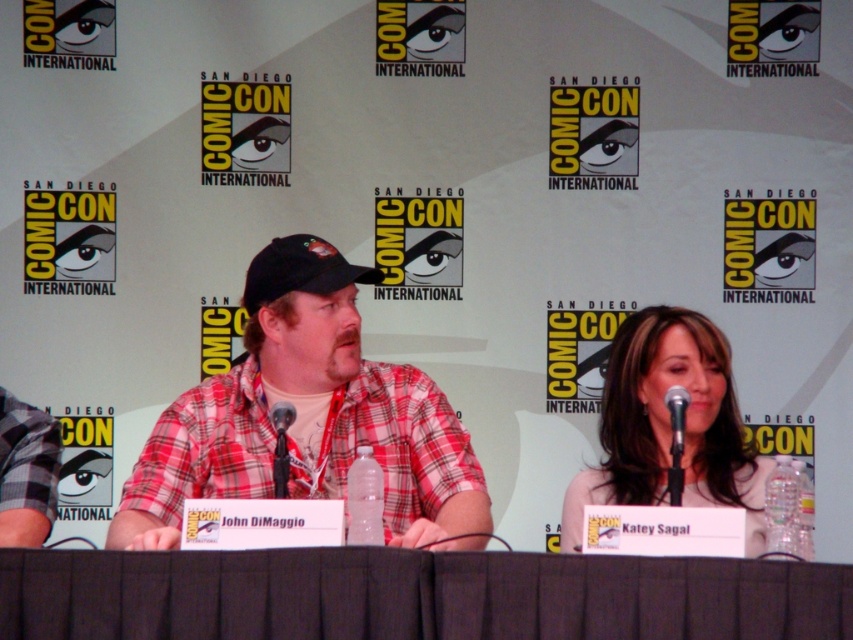
Does smooth beige blouse at center appear under black fabric baseball cap at center?

Correct, smooth beige blouse at center is located below black fabric baseball cap at center.

Can you confirm if smooth beige blouse at center is taller than black fabric baseball cap at center?

Yes.

Which is in front, point (683, 484) or point (274, 244)?

Point (683, 484) is more forward.

The image size is (853, 640). Identify the location of smooth beige blouse at center. (670, 428).

Is black fabric table at center positioned behind black metallic microphone at center?

No, it is not.

Identify the location of black fabric table at center. Image resolution: width=853 pixels, height=640 pixels. (415, 595).

Identify the location of black fabric table at center. (415, 595).

Does plaid shirt at center have a greater width compared to black metallic microphone at center?

Indeed, plaid shirt at center has a greater width compared to black metallic microphone at center.

Which is more to the left, plaid shirt at center or black metallic microphone at center?

Positioned to the left is plaid shirt at center.

Does point (318, 476) come behind point (683, 401)?

Yes, it is.

I want to click on plaid shirt at center, so click(x=308, y=417).